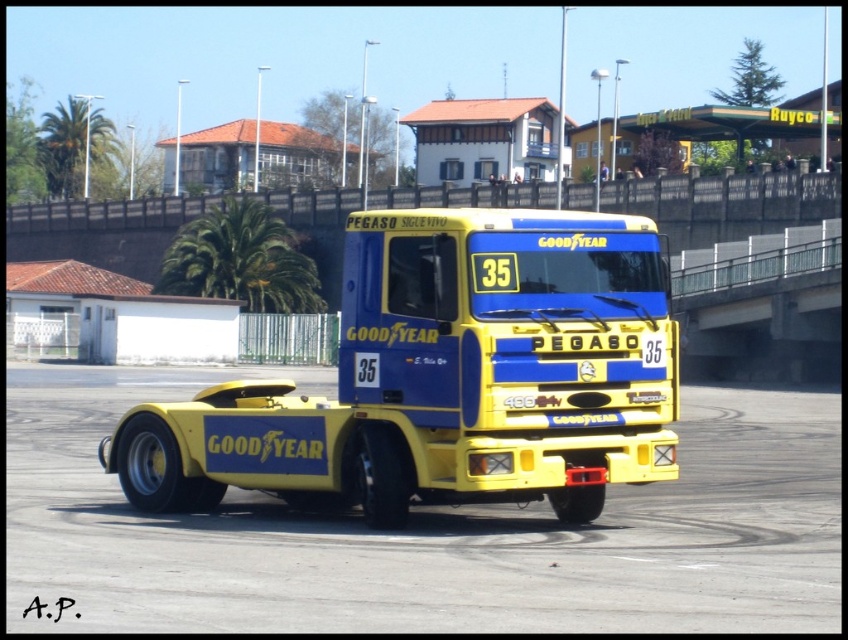
Which is behind, point (70, 387) or point (131, 436)?

The point (70, 387) is behind.

Measure the distance between point (318, 576) and camera.

Point (318, 576) and camera are 10.93 meters apart.

Which is behind, point (824, 552) or point (131, 481)?

The point (131, 481) is more distant.

At what (x,y) coordinates should I click in order to perform the action: click on yellow rubber dirt track at center. Please return your answer as a coordinate pair (x, y). The image size is (848, 640). Looking at the image, I should click on (428, 532).

Is yellow matte tow truck at center to the left of shiny silver tire at lower left from the viewer's perspective?

Indeed, yellow matte tow truck at center is positioned on the left side of shiny silver tire at lower left.

Where is `yellow matte tow truck at center`? The width and height of the screenshot is (848, 640). yellow matte tow truck at center is located at coordinates (445, 378).

Locate an element on the screen. yellow matte tow truck at center is located at coordinates (445, 378).

Does yellow rubber dirt track at center have a greater width compared to yellow matte tow truck at center?

Yes.

From the picture: Between yellow rubber dirt track at center and yellow matte tow truck at center, which one appears on the right side from the viewer's perspective?

Positioned to the right is yellow rubber dirt track at center.

Is point (632, 566) closer to viewer compared to point (629, 296)?

Yes, it is in front of point (629, 296).

You are a GUI agent. You are given a task and a screenshot of the screen. Output one action in this format:
    pyautogui.click(x=<x>, y=<y>)
    Task: Click on the yellow rubber dirt track at center
    This screenshot has width=848, height=640.
    Given the screenshot: What is the action you would take?
    pyautogui.click(x=428, y=532)